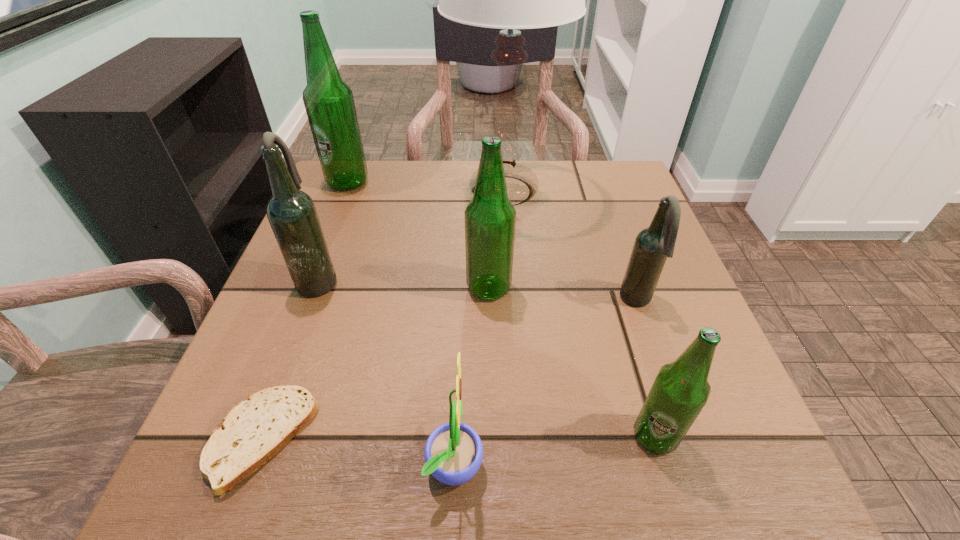
Select which green beer bottle is the second closest to the farthest beer bottle. Please provide its 2D coordinates. Your answer should be formatted as a tuple, i.e. [(x, y)], where the tuple contains the x and y coordinates of a point satisfying the conditions above.

[(680, 391)]

At what (x,y) coordinates should I click in order to perform the action: click on free space in the image that satisfies the following two spatial constraints: 1. on the label of the rightmost green beer bottle; 2. on the front-facing side of the sunflower. Please return your answer as a coordinate pair (x, y). This screenshot has width=960, height=540. Looking at the image, I should click on (662, 461).